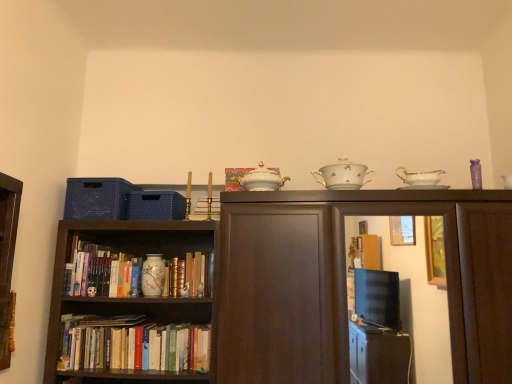
This screenshot has height=384, width=512. Find the location of `hardcover books at lower center, the 3th book from the right`. hardcover books at lower center, the 3th book from the right is located at coordinates (133, 344).

Describe the element at coordinates (345, 283) in the screenshot. I see `matte dark wood cabinet at center` at that location.

Where is `porcelain vase at center, the first tableware from the left`? The image size is (512, 384). porcelain vase at center, the first tableware from the left is located at coordinates (153, 275).

Is matte dark wood cabinet at center next to porcelain bowl at upper center, placed as the 3th book when sorted from bottom to top, and touching it?

No, matte dark wood cabinet at center is not with porcelain bowl at upper center, placed as the 3th book when sorted from bottom to top.

Can porcelain bowl at upper center, which ranks as the third book in back-to-front order, be found inside matte dark wood cabinet at center?

Definitely not — porcelain bowl at upper center, which ranks as the third book in back-to-front order, is not inside matte dark wood cabinet at center.

Visually, is matte dark wood cabinet at center positioned to the left or to the right of porcelain bowl at upper center, which is the first book from front to back?

Based on their positions, matte dark wood cabinet at center is located to the right of porcelain bowl at upper center, which is the first book from front to back.

Does point (489, 210) lie behind point (226, 189)?

No, it is in front of (226, 189).

Is white porcelain sugar bowl at upper center, the second tableware from the back, inside porcelain vase at center, placed as the second tableware when sorted from front to back?

No, white porcelain sugar bowl at upper center, the second tableware from the back, is not inside porcelain vase at center, placed as the second tableware when sorted from front to back.

How many degrees apart are the facing directions of porcelain vase at center, which appears as the 1th tableware when ordered from the bottom, and white porcelain sugar bowl at upper center, acting as the 1th tableware starting from the front?

The facing directions of porcelain vase at center, which appears as the 1th tableware when ordered from the bottom, and white porcelain sugar bowl at upper center, acting as the 1th tableware starting from the front, are 0.272 degrees apart.

Which of these two, porcelain vase at center, the second tableware viewed from the top, or white porcelain sugar bowl at upper center, the second tableware from the back, is bigger?

With larger size is white porcelain sugar bowl at upper center, the second tableware from the back.

Which point is more distant from viewer, (164, 284) or (344, 159)?

The point (344, 159) is behind.

Considering the relative sizes of porcelain vase at center, the 2th tableware when ordered from right to left, and porcelain bowl at upper center, placed as the 3th book when sorted from bottom to top, in the image provided, is porcelain vase at center, the 2th tableware when ordered from right to left, bigger than porcelain bowl at upper center, placed as the 3th book when sorted from bottom to top,?

Indeed, porcelain vase at center, the 2th tableware when ordered from right to left, has a larger size compared to porcelain bowl at upper center, placed as the 3th book when sorted from bottom to top.

Do you think porcelain vase at center, the first tableware when ordered from back to front, is within porcelain bowl at upper center, which ranks as the third book in back-to-front order, or outside of it?

porcelain vase at center, the first tableware when ordered from back to front, lies outside porcelain bowl at upper center, which ranks as the third book in back-to-front order.

Is porcelain vase at center, which appears as the 1th tableware when ordered from the bottom, positioned with its back to porcelain bowl at upper center, placed as the 3th book when sorted from bottom to top?

No.

Consider the image. Is hardcover books at lower center, the 3th book from the right, not inside porcelain bowl at upper center, which is the first book from right to left?

Absolutely, hardcover books at lower center, the 3th book from the right, is external to porcelain bowl at upper center, which is the first book from right to left.

Considering the points (155, 338) and (241, 189), which point is behind, point (155, 338) or point (241, 189)?

The point (155, 338) is farther from the camera.

How many degrees apart are the facing directions of hardcover books at lower center, arranged as the 1th book when viewed from the left, and porcelain bowl at upper center, which ranks as the third book in back-to-front order?

The angle between the facing direction of hardcover books at lower center, arranged as the 1th book when viewed from the left, and the facing direction of porcelain bowl at upper center, which ranks as the third book in back-to-front order, is 1.54 degrees.

From a real-world perspective, starting from the matte dark wood cabinet at center, which tableware is the 2nd one vertically above it? Please provide its 2D coordinates.

[(342, 175)]

Is matte dark wood cabinet at center not inside white porcelain sugar bowl at upper center, the second tableware from the back?

Yes, matte dark wood cabinet at center is outside of white porcelain sugar bowl at upper center, the second tableware from the back.

How far apart are matte dark wood cabinet at center and white porcelain sugar bowl at upper center, the first tableware from the top?

15.71 inches.

Considering the points (294, 336) and (329, 166), which point is behind, point (294, 336) or point (329, 166)?

Point (329, 166)

Which of these two, porcelain bowl at upper center, placed as the 3th book when sorted from bottom to top, or matte ceramic book at center, which is the first book from back to front, is smaller?

Smaller between the two is porcelain bowl at upper center, placed as the 3th book when sorted from bottom to top.

Can you tell me how much porcelain bowl at upper center, which ranks as the third book in back-to-front order, and matte ceramic book at center, the second book in the bottom-to-top sequence, differ in facing direction?

The angle between the facing direction of porcelain bowl at upper center, which ranks as the third book in back-to-front order, and the facing direction of matte ceramic book at center, the second book in the bottom-to-top sequence, is 1.55 degrees.

Is porcelain bowl at upper center, which is the first book from front to back, in contact with matte ceramic book at center, the 2th book in the right-to-left sequence?

No, porcelain bowl at upper center, which is the first book from front to back, is not next to matte ceramic book at center, the 2th book in the right-to-left sequence.

Is hardcover books at lower center, marked as the 1th book in a bottom-to-top arrangement, oriented towards porcelain vase at center, placed as the second tableware when sorted from front to back?

No, hardcover books at lower center, marked as the 1th book in a bottom-to-top arrangement, does not turn towards porcelain vase at center, placed as the second tableware when sorted from front to back.

How different are the orientations of hardcover books at lower center, marked as the 1th book in a bottom-to-top arrangement, and porcelain vase at center, the first tableware when ordered from back to front, in degrees?

The angular difference between hardcover books at lower center, marked as the 1th book in a bottom-to-top arrangement, and porcelain vase at center, the first tableware when ordered from back to front, is 0.00133 degrees.

Is point (144, 359) closer to camera compared to point (158, 291)?

That is True.

Does hardcover books at lower center, the 2th book when ordered from back to front, have a smaller size compared to porcelain vase at center, the first tableware from the left?

Actually, hardcover books at lower center, the 2th book when ordered from back to front, might be larger than porcelain vase at center, the first tableware from the left.

Find the location of a particular element. This screenshot has width=512, height=384. bookcase located on the right of porcelain bowl at upper center, placed as the 3th book when sorted from bottom to top is located at coordinates (345, 283).

You are a GUI agent. You are given a task and a screenshot of the screen. Output one action in this format:
    pyautogui.click(x=<x>, y=<y>)
    Task: Click on the tableware located above the porcelain vase at center, placed as the second tableware when sorted from front to back (from the image's perspective)
    
    Given the screenshot: What is the action you would take?
    pyautogui.click(x=342, y=175)

Considering their positions, is hardcover books at lower center, the 2th book when ordered from back to front, positioned closer to matte ceramic book at center, which is counted as the 2th book, starting from the left, than porcelain bowl at upper center, which is the first book from right to left?

hardcover books at lower center, the 2th book when ordered from back to front.

Based on their spatial positions, is porcelain bowl at upper center, which is the first book from right to left, or porcelain vase at center, which appears as the 1th tableware when ordered from the bottom, closer to matte ceramic book at center, the 2th book in the right-to-left sequence?

porcelain vase at center, which appears as the 1th tableware when ordered from the bottom, is closer to matte ceramic book at center, the 2th book in the right-to-left sequence.

Consider the image. Considering their positions, is porcelain vase at center, the first tableware from the left, positioned further to white porcelain sugar bowl at upper center, the first tableware from the top, than matte ceramic book at center, the second book in the bottom-to-top sequence?

Based on the image, porcelain vase at center, the first tableware from the left, appears to be further to white porcelain sugar bowl at upper center, the first tableware from the top.

Based on their spatial positions, is hardcover books at lower center, the 2th book when ordered from back to front, or matte dark wood cabinet at center closer to porcelain vase at center, the first tableware when ordered from back to front?

hardcover books at lower center, the 2th book when ordered from back to front.

From the picture: Considering their positions, is matte dark wood cabinet at center positioned closer to hardcover books at lower center, arranged as the 1th book when viewed from the left, than white porcelain sugar bowl at upper center, the second tableware from the back?

matte dark wood cabinet at center is closer to hardcover books at lower center, arranged as the 1th book when viewed from the left.

Estimate the real-world distances between objects in this image. Which object is further from hardcover books at lower center, arranged as the 1th book when viewed from the left, porcelain bowl at upper center, which is the first book from right to left, or matte ceramic book at center, acting as the third book starting from the front?

Based on the image, porcelain bowl at upper center, which is the first book from right to left, appears to be further to hardcover books at lower center, arranged as the 1th book when viewed from the left.

Which object lies further to the anchor point hardcover books at lower center, the 2th book when ordered from back to front, porcelain vase at center, which appears as the 1th tableware when ordered from the bottom, or matte dark wood cabinet at center?

The object further to hardcover books at lower center, the 2th book when ordered from back to front, is matte dark wood cabinet at center.

When comparing their distances from matte ceramic book at center, the 2th book in the right-to-left sequence, does porcelain vase at center, the 2th tableware when ordered from right to left, or porcelain bowl at upper center, which ranks as the third book in back-to-front order, seem further?

porcelain bowl at upper center, which ranks as the third book in back-to-front order, lies further to matte ceramic book at center, the 2th book in the right-to-left sequence, than the other object.

You are a GUI agent. You are given a task and a screenshot of the screen. Output one action in this format:
    pyautogui.click(x=<x>, y=<y>)
    Task: Click on the book that lies between porcelain bowl at upper center, which is the first book from right to left, and hardcover books at lower center, arranged as the 2th book when viewed from the front, from top to bottom
    This screenshot has height=384, width=512.
    Given the screenshot: What is the action you would take?
    pyautogui.click(x=190, y=276)

This screenshot has width=512, height=384. Find the location of `book between white porcelain sugar bowl at upper center, the first tableware from the top, and matte dark wood cabinet at center, in the vertical direction`. book between white porcelain sugar bowl at upper center, the first tableware from the top, and matte dark wood cabinet at center, in the vertical direction is located at coordinates (234, 178).

Identify the location of tableware between porcelain bowl at upper center, acting as the third book starting from the left, and matte ceramic book at center, arranged as the 2th book when viewed from the top, from top to bottom. (153, 275).

This screenshot has height=384, width=512. Find the location of `tableware between porcelain bowl at upper center, which appears as the 1th book when viewed from the top, and hardcover books at lower center, the 3th book from the right, in the up-down direction`. tableware between porcelain bowl at upper center, which appears as the 1th book when viewed from the top, and hardcover books at lower center, the 3th book from the right, in the up-down direction is located at coordinates (153, 275).